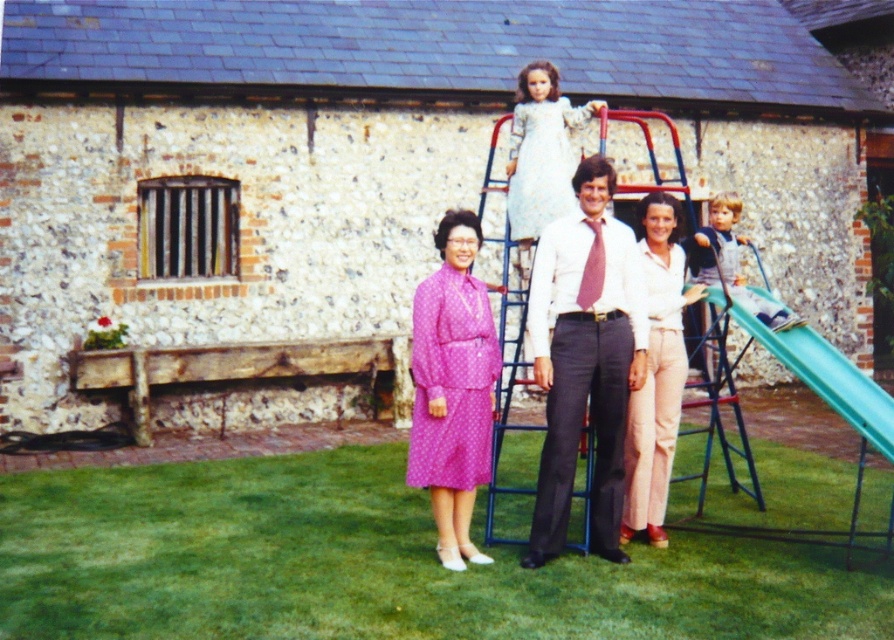
Question: Can you confirm if pink polka dot dress at center is thinner than light beige cotton pants at center?

Choices:
 (A) no
 (B) yes

Answer: (B)

Question: Among these objects, which one is farthest from the camera?

Choices:
 (A) light beige cotton pants at center
 (B) green plastic slide at right

Answer: (A)

Question: Does matte white shirt at center have a smaller size compared to light brown denim overalls at right?

Choices:
 (A) no
 (B) yes

Answer: (B)

Question: Which point is closer to the camera?

Choices:
 (A) green grass at lower center
 (B) light beige cotton pants at center
 (C) matte white shirt at center

Answer: (A)

Question: Can you confirm if pink polka dot dress at center is wider than green plastic slide at right?

Choices:
 (A) yes
 (B) no

Answer: (B)

Question: Which object is the farthest from the pink polka dot dress at center?

Choices:
 (A) matte white shirt at center
 (B) green grass at lower center
 (C) light beige cotton pants at center
 (D) green plastic slide at right

Answer: (D)